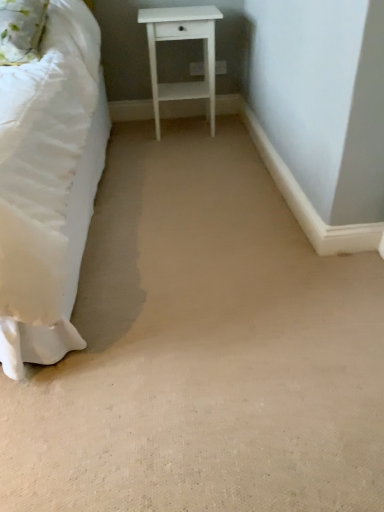
Question: In terms of size, does white matte nightstand at center appear bigger or smaller than fluffy white pillow at upper left?

Choices:
 (A) small
 (B) big

Answer: (B)

Question: Choose the correct answer: Is white matte nightstand at center inside fluffy white pillow at upper left or outside it?

Choices:
 (A) inside
 (B) outside

Answer: (B)

Question: Is white matte nightstand at center in front of or behind fluffy white pillow at upper left in the image?

Choices:
 (A) front
 (B) behind

Answer: (B)

Question: From the image's perspective, relative to white matte nightstand at center, is fluffy white pillow at upper left above or below?

Choices:
 (A) below
 (B) above

Answer: (A)

Question: Relative to white matte nightstand at center, is fluffy white pillow at upper left in front or behind?

Choices:
 (A) front
 (B) behind

Answer: (A)

Question: Is fluffy white pillow at upper left taller or shorter than white matte nightstand at center?

Choices:
 (A) short
 (B) tall

Answer: (A)

Question: Is fluffy white pillow at upper left spatially inside white matte nightstand at center, or outside of it?

Choices:
 (A) outside
 (B) inside

Answer: (A)